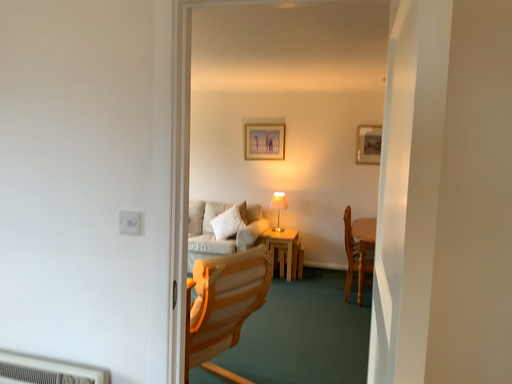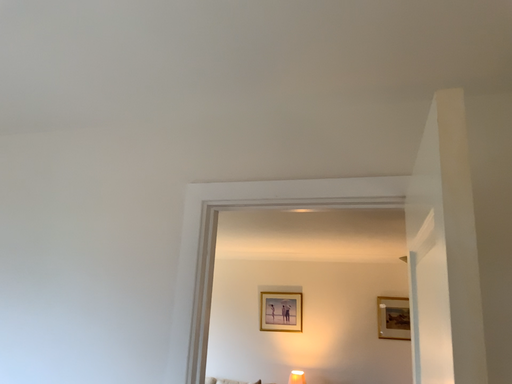
Question: Which way did the camera rotate in the video?

Choices:
 (A) rotated downward
 (B) rotated upward

Answer: (B)